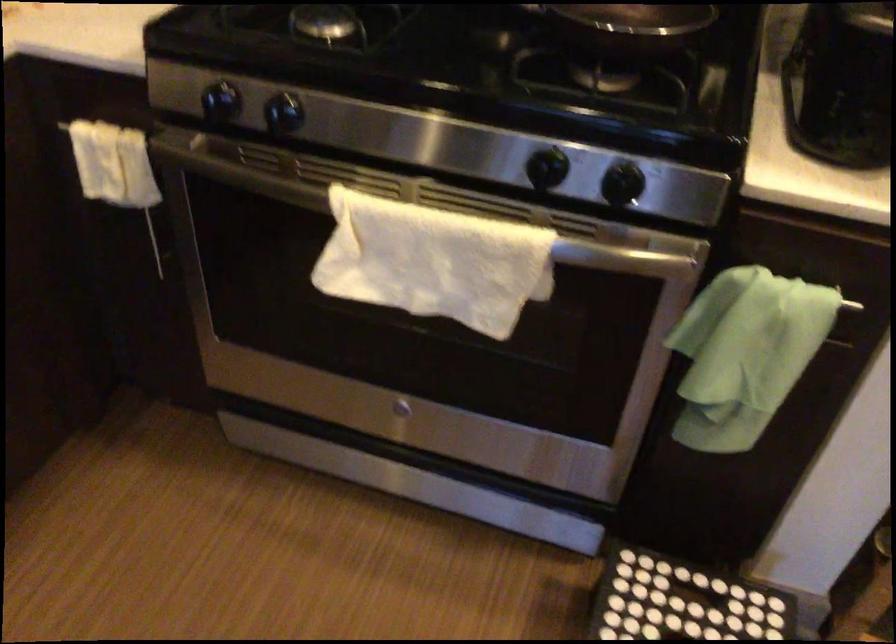
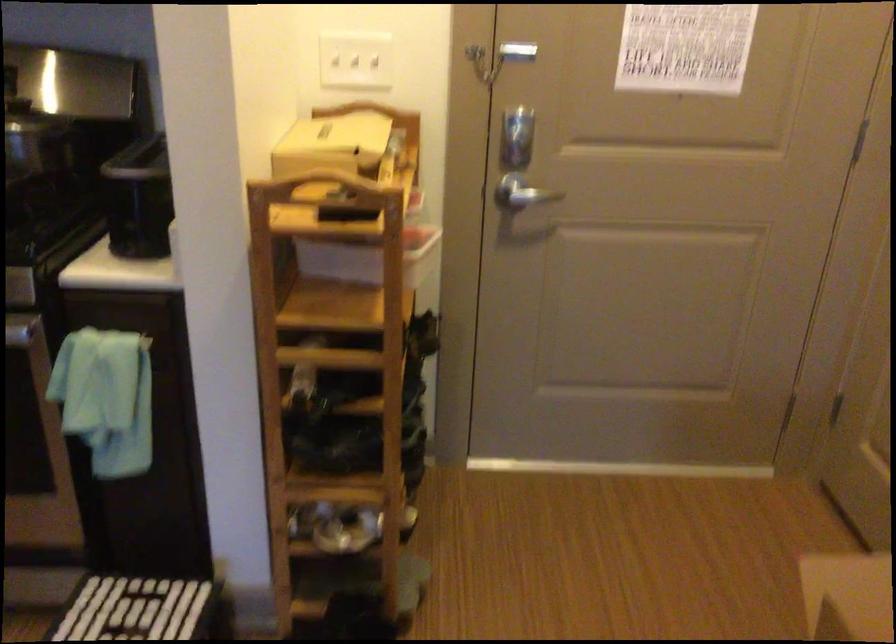
Question: Based on the continuous images, in which direction is the camera rotating? Reply with the corresponding letter.

Choices:
 (A) Left
 (B) Right
 (C) Up
 (D) Down

Answer: (B)